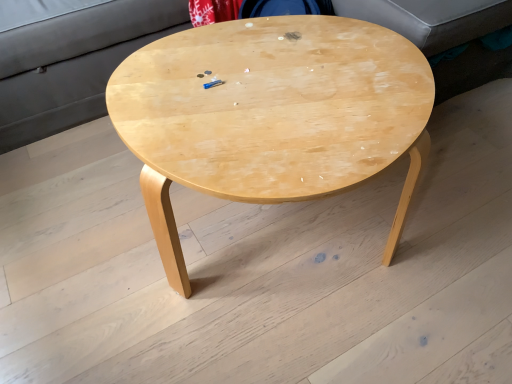
Locate an element on the screen. Image resolution: width=512 pixels, height=384 pixels. free space to the left of natural wood coffee table at center is located at coordinates (84, 266).